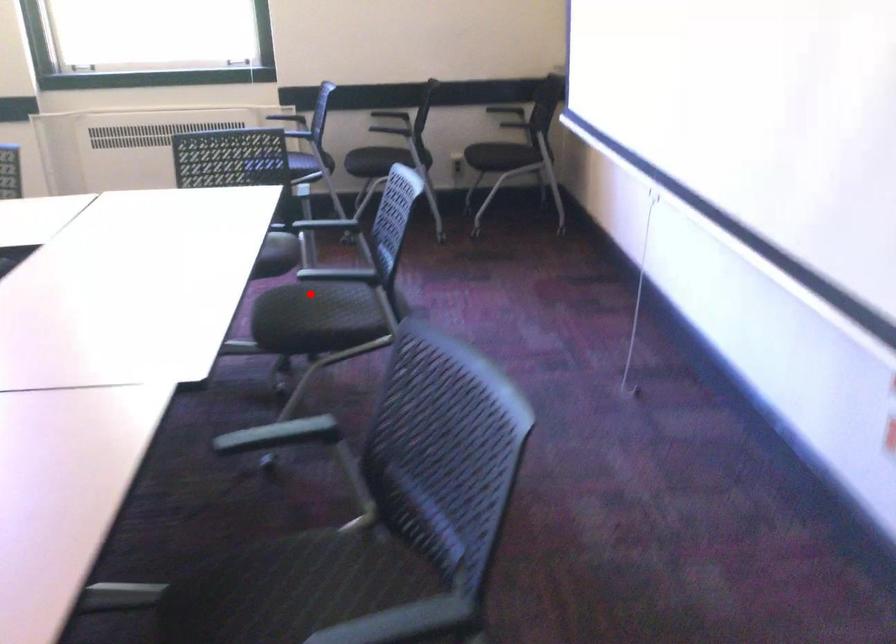
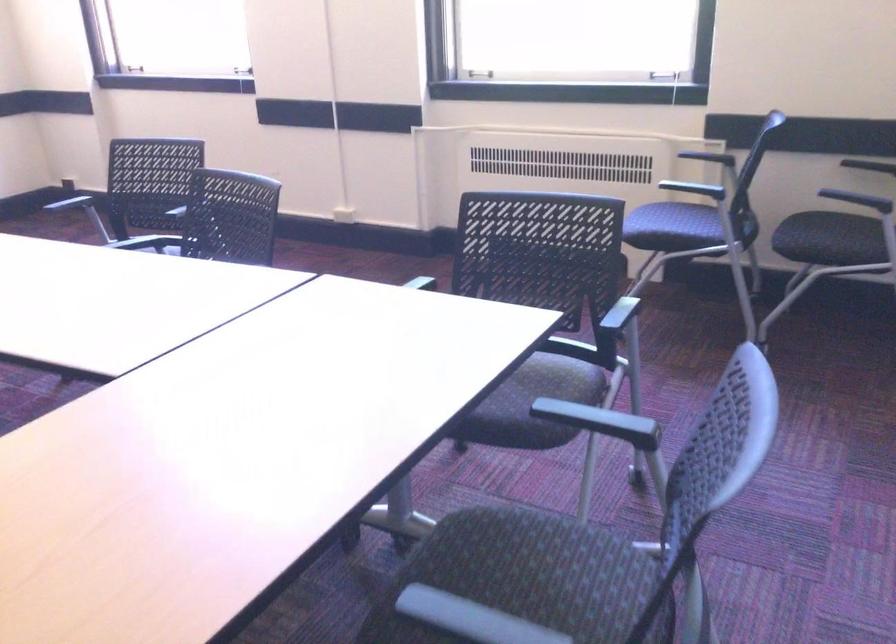
Locate, in the second image, the point that corresponds to the highlighted location in the first image.

(533, 556)